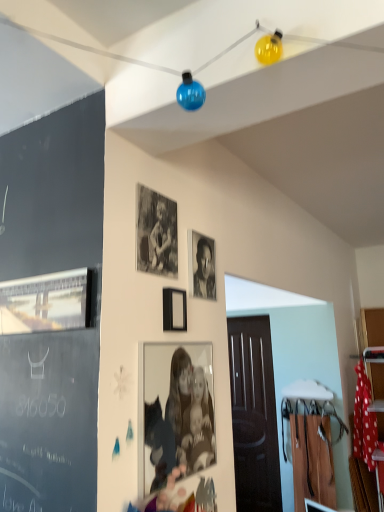
Question: Can you confirm if black matte photo frame at upper center, which is counted as the 2th picture frame, starting from the left, is taller than black matte picture frame at center, positioned as the 3th picture frame in top-to-bottom order?

Choices:
 (A) no
 (B) yes

Answer: (B)

Question: Can you confirm if black matte photo frame at upper center, which is counted as the 2th picture frame, starting from the left, is bigger than black matte picture frame at center, positioned as the second picture frame in bottom-to-top order?

Choices:
 (A) yes
 (B) no

Answer: (A)

Question: From a real-world perspective, is black matte photo frame at upper center, the 1th picture frame viewed from the top, on top of black matte picture frame at center, positioned as the second picture frame in bottom-to-top order?

Choices:
 (A) yes
 (B) no

Answer: (A)

Question: From the image's perspective, does black matte photo frame at upper center, which is counted as the 2th picture frame, starting from the left, appear higher than black matte picture frame at center, positioned as the 3th picture frame in top-to-bottom order?

Choices:
 (A) no
 (B) yes

Answer: (B)

Question: Considering the relative sizes of black matte photo frame at upper center, which is counted as the 2th picture frame, starting from the left, and black matte picture frame at center, which is the 3th picture frame in left-to-right order, in the image provided, is black matte photo frame at upper center, which is counted as the 2th picture frame, starting from the left, smaller than black matte picture frame at center, which is the 3th picture frame in left-to-right order,?

Choices:
 (A) yes
 (B) no

Answer: (B)

Question: Is black matte photo frame at upper center, which is the 4th picture frame from bottom to top, thinner than black matte picture frame at center, positioned as the second picture frame in bottom-to-top order?

Choices:
 (A) no
 (B) yes

Answer: (B)

Question: Are black matte photo frame at upper center, the 1th picture frame viewed from the top, and metallic silver picture frame at left, acting as the 3th picture frame starting from the bottom, making contact?

Choices:
 (A) no
 (B) yes

Answer: (A)

Question: From the image's perspective, is black matte photo frame at upper center, which is counted as the 2th picture frame, starting from the left, below metallic silver picture frame at left, which appears as the fourth picture frame when viewed from the right?

Choices:
 (A) yes
 (B) no

Answer: (B)

Question: Could you tell me if black matte photo frame at upper center, which is counted as the 2th picture frame, starting from the left, is facing metallic silver picture frame at left, which is the 2th picture frame in top-to-bottom order?

Choices:
 (A) yes
 (B) no

Answer: (B)

Question: Considering the relative sizes of black matte photo frame at upper center, which is the 4th picture frame from bottom to top, and metallic silver picture frame at left, which is the 2th picture frame in top-to-bottom order, in the image provided, is black matte photo frame at upper center, which is the 4th picture frame from bottom to top, wider than metallic silver picture frame at left, which is the 2th picture frame in top-to-bottom order,?

Choices:
 (A) yes
 (B) no

Answer: (B)

Question: Are black matte photo frame at upper center, the 1th picture frame viewed from the top, and metallic silver picture frame at left, which is the first picture frame in left-to-right order, located far from each other?

Choices:
 (A) yes
 (B) no

Answer: (B)

Question: Is black matte photo frame at upper center, the 1th picture frame viewed from the top, at the right side of metallic silver picture frame at left, which is the first picture frame in left-to-right order?

Choices:
 (A) no
 (B) yes

Answer: (B)

Question: Does metallic silver picture frame at left, which appears as the fourth picture frame when viewed from the right, have a greater height compared to black and white photograph at center?

Choices:
 (A) no
 (B) yes

Answer: (A)